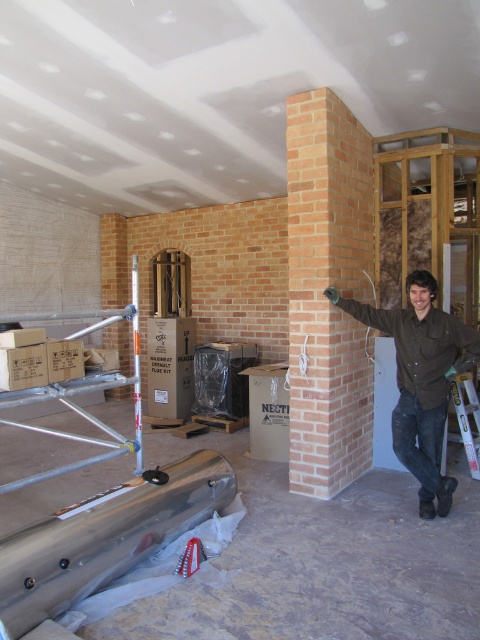
Based on the photo, you are a construction worker who needs to access the top of the light brown brick chimney at center to install a vent. The metallic silver ladder at right is available. Can you safely place the ladder against the chimney to climb up?

The light brown brick chimney at center is positioned over metallic silver ladder at right, meaning the ladder is underneath the chimney. Since the ladder is already placed under the chimney, you can safely position it against the chimney to climb up and install the vent.

You are a construction inspector reviewing the site layout. You notice two points marked on the blueprint at coordinates point (310, 273) and point (462, 433). Based on the image, which point is closer to your current position?

Point (310, 273) is closer to the camera than point (462, 433), so the point closer to your current position is point (310, 273).

You are a construction worker who just finished laying bricks for the day. You notice a point marked at coordinates (420, 380). What object is located at that point?

The point at coordinates (420, 380) marks the brown cotton shirt at center.